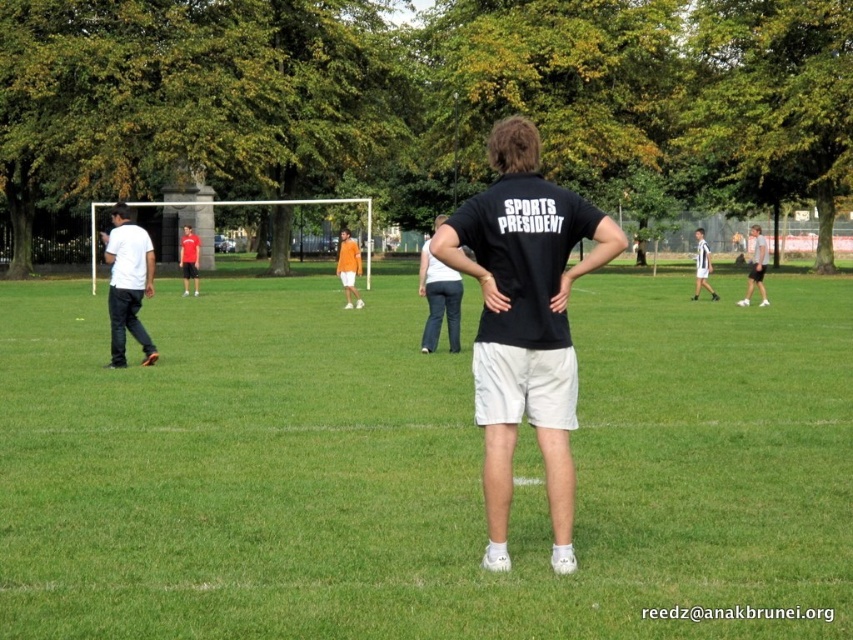
You are a photographer trying to capture a candid shot of the person in the white jersey at center without including the white matte shorts at center in the frame. Given their positions, is it possible to do so?

The white matte shorts at center are to the right of the white jersey at center. Since the white jersey is to the left of the white matte shorts, you can position your camera to focus on the white jersey at center while angling away from the right side to exclude the white matte shorts at center from the shot.

You are a photographer at the park and want to take a photo of the white matte shorts at center and the white jersey at center. Which one is positioned higher in the image?

The white matte shorts at center is located above the white jersey at center, so it is positioned higher in the image.

You are a photographer positioned at the back of the field. You want to take a photo that includes both the white matte shirt at left and the denim jeans at center. Which object should you focus on first to ensure both are in the frame?

You should focus on the white matte shirt at left first because it is closer to you than the denim jeans at center, ensuring both will be in the frame when properly adjusted.